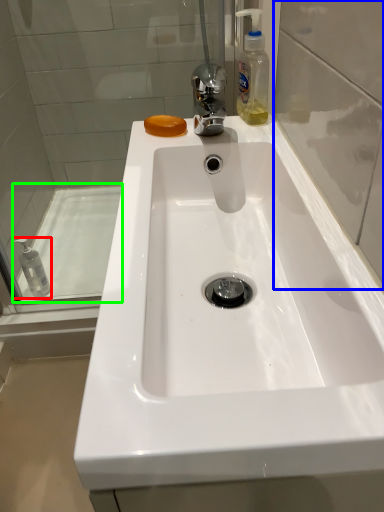
Question: Estimate the real-world distances between objects in this image. Which object is farther from mouthwash (highlighted by a red box), glass door (highlighted by a blue box) or bath (highlighted by a green box)?

Choices:
 (A) glass door
 (B) bath

Answer: (A)